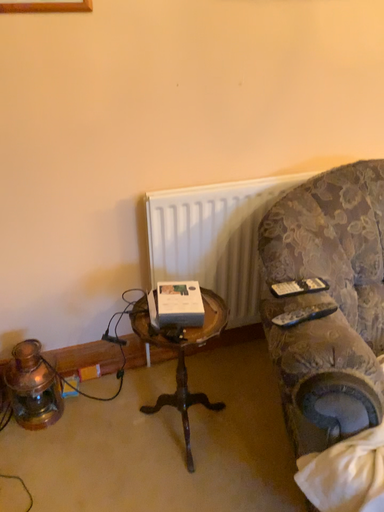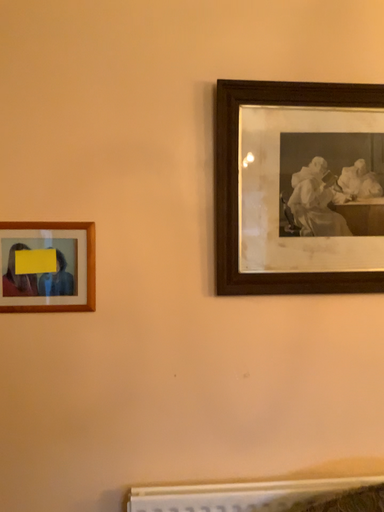
Question: Which way did the camera rotate in the video?

Choices:
 (A) rotated right
 (B) rotated left

Answer: (B)